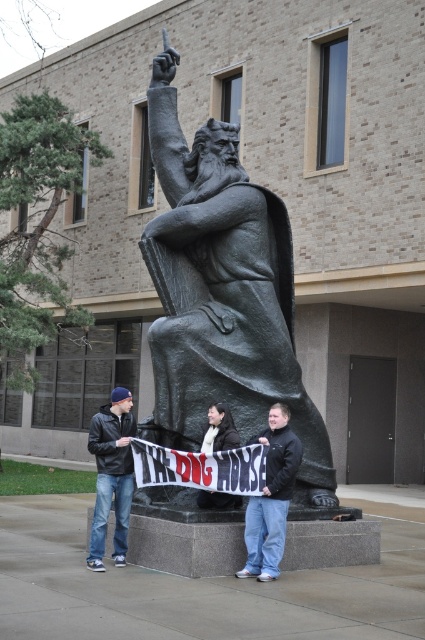
Question: Which is farther from the matte black jacket at center?

Choices:
 (A) bronze statue at center
 (B) white scarf at center
 (C) black leather jacket at lower left

Answer: (C)

Question: Which of these objects is positioned farthest from the bronze statue at center?

Choices:
 (A) matte black jacket at center
 (B) white scarf at center

Answer: (A)

Question: Which is farther from the matte black jacket at center?

Choices:
 (A) white scarf at center
 (B) black leather jacket at lower left

Answer: (B)

Question: Is black leather jacket at lower left in front of matte black jacket at center?

Choices:
 (A) no
 (B) yes

Answer: (A)

Question: Can you confirm if black leather jacket at lower left is positioned to the left of matte black jacket at center?

Choices:
 (A) no
 (B) yes

Answer: (B)

Question: Is black leather jacket at lower left to the right of white scarf at center from the viewer's perspective?

Choices:
 (A) no
 (B) yes

Answer: (A)